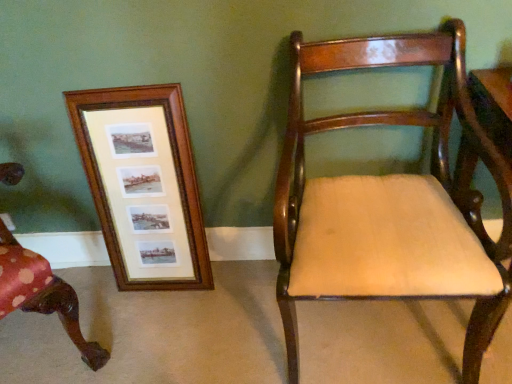
Question: Considering the relative positions of wooden frame at left and wooden chair at left, which is counted as the second chair, starting from the right, in the image provided, is wooden frame at left to the left or to the right of wooden chair at left, which is counted as the second chair, starting from the right,?

Choices:
 (A) right
 (B) left

Answer: (A)

Question: Is wooden frame at left taller or shorter than wooden chair at left, which is counted as the second chair, starting from the right?

Choices:
 (A) short
 (B) tall

Answer: (A)

Question: Which is nearer to the wooden frame at left?

Choices:
 (A) mahogany wood chair at right, which is the 2th chair from left to right
 (B) wooden chair at left, which is counted as the second chair, starting from the right

Answer: (B)

Question: Estimate the real-world distances between objects in this image. Which object is closer to the mahogany wood chair at right, the 1th chair viewed from the right?

Choices:
 (A) wooden frame at left
 (B) wooden chair at left, marked as the first chair in a left-to-right arrangement

Answer: (A)